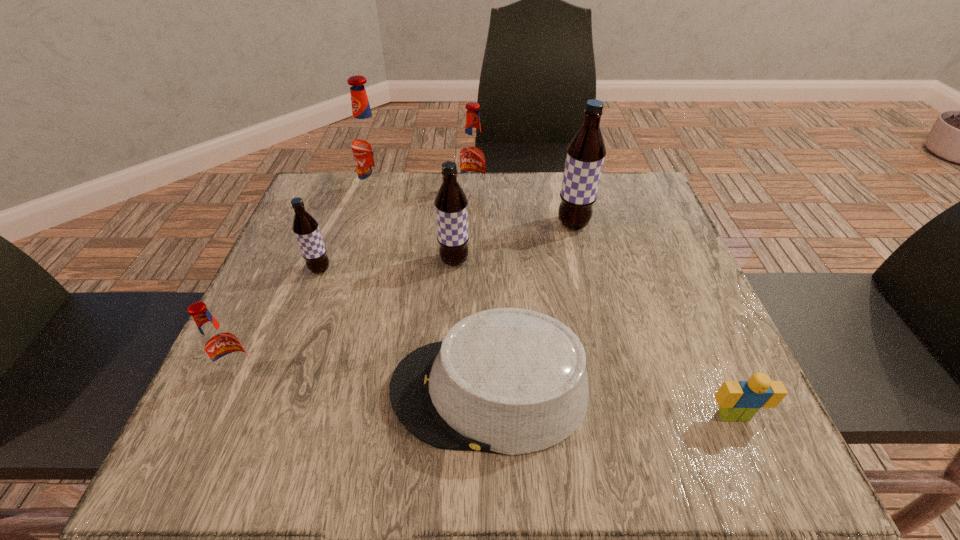
Where is `vacant area at the left edge of the desktop`? This screenshot has height=540, width=960. vacant area at the left edge of the desktop is located at coordinates (342, 232).

Find the location of a particular element. This screenshot has height=540, width=960. vacant space at the right edge is located at coordinates (699, 400).

In the image, there is a desktop. Find the location of `vacant space at the far left corner`. vacant space at the far left corner is located at coordinates (309, 189).

This screenshot has width=960, height=540. I want to click on vacant space at the near left corner of the desktop, so click(x=252, y=417).

Image resolution: width=960 pixels, height=540 pixels. In order to click on vacant space in between the second red root beer from right to left and the second root beer from left to right in this screenshot , I will do `click(349, 232)`.

Where is `vacant area that lies between the second smallest red root beer and the fifth root beer from right to left`? vacant area that lies between the second smallest red root beer and the fifth root beer from right to left is located at coordinates (396, 232).

The height and width of the screenshot is (540, 960). I want to click on free space between the third farthest object and the third root beer from left to right, so click(475, 210).

Find the location of a particular element. The image size is (960, 540). free space between the hat and the biggest brown root beer is located at coordinates (531, 308).

This screenshot has height=540, width=960. Find the location of `empty space that is in between the third object from left to right and the hat`. empty space that is in between the third object from left to right and the hat is located at coordinates (434, 293).

Where is `free area in between the rightmost object and the second brown root beer from right to left`? The width and height of the screenshot is (960, 540). free area in between the rightmost object and the second brown root beer from right to left is located at coordinates (594, 338).